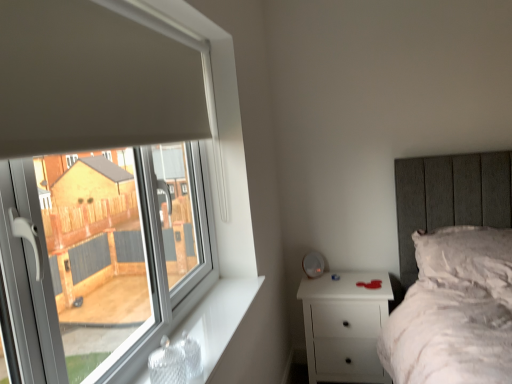
Question: Should I look upward or downward to see white plastic window at left?

Choices:
 (A) down
 (B) up

Answer: (A)

Question: Considering the relative sizes of white fluffy pillow at upper right and white plastic window at left in the image provided, is white fluffy pillow at upper right thinner than white plastic window at left?

Choices:
 (A) no
 (B) yes

Answer: (A)

Question: Is white fluffy pillow at upper right outside of white plastic window at left?

Choices:
 (A) no
 (B) yes

Answer: (B)

Question: Can you confirm if white fluffy pillow at upper right is wider than white plastic window at left?

Choices:
 (A) no
 (B) yes

Answer: (B)

Question: Does white fluffy pillow at upper right appear on the right side of white plastic window at left?

Choices:
 (A) no
 (B) yes

Answer: (B)

Question: From a real-world perspective, is white fluffy pillow at upper right under white plastic window at left?

Choices:
 (A) yes
 (B) no

Answer: (A)

Question: Is white fluffy pillow at upper right closer to camera compared to white plastic window at left?

Choices:
 (A) yes
 (B) no

Answer: (B)

Question: From the image's perspective, is white fluffy pillow at upper right below white matte nightstand at lower right?

Choices:
 (A) no
 (B) yes

Answer: (A)

Question: Considering the relative sizes of white fluffy pillow at upper right and white matte nightstand at lower right in the image provided, is white fluffy pillow at upper right taller than white matte nightstand at lower right?

Choices:
 (A) no
 (B) yes

Answer: (A)

Question: From the image's perspective, is white fluffy pillow at upper right above white matte nightstand at lower right?

Choices:
 (A) yes
 (B) no

Answer: (A)

Question: Is white fluffy pillow at upper right further to camera compared to white matte nightstand at lower right?

Choices:
 (A) yes
 (B) no

Answer: (B)

Question: Is white fluffy pillow at upper right smaller than white matte nightstand at lower right?

Choices:
 (A) yes
 (B) no

Answer: (A)

Question: Is white fluffy pillow at upper right at the left side of white matte nightstand at lower right?

Choices:
 (A) no
 (B) yes

Answer: (A)

Question: Is white matte nightstand at lower right to the left of white fluffy pillow at upper right from the viewer's perspective?

Choices:
 (A) no
 (B) yes

Answer: (B)